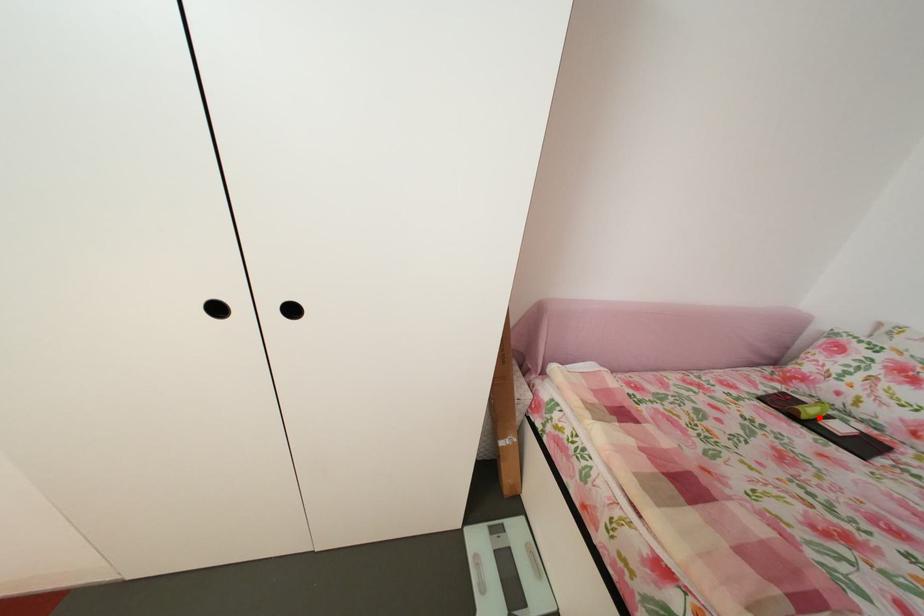
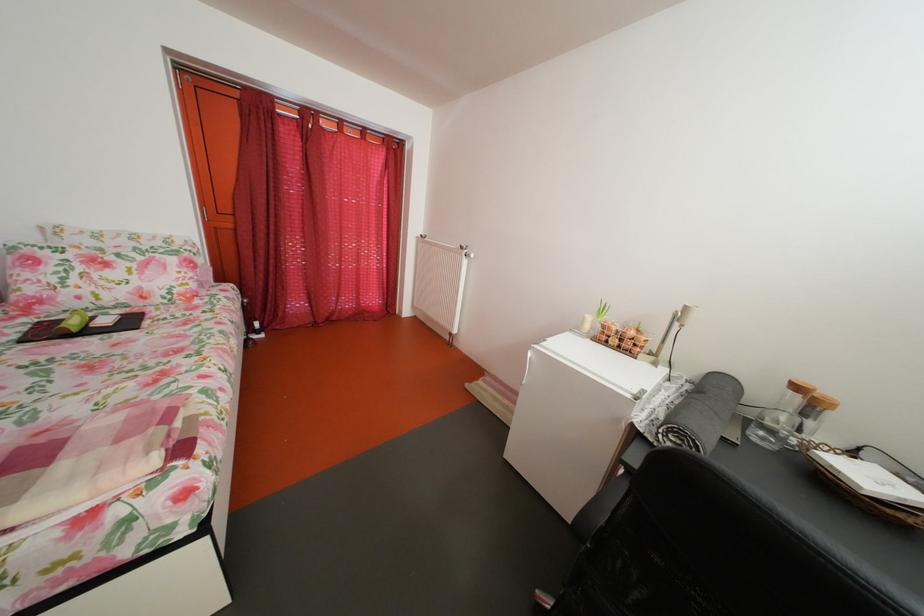
In the second image, find the point that corresponds to the highlighted location in the first image.

(83, 330)